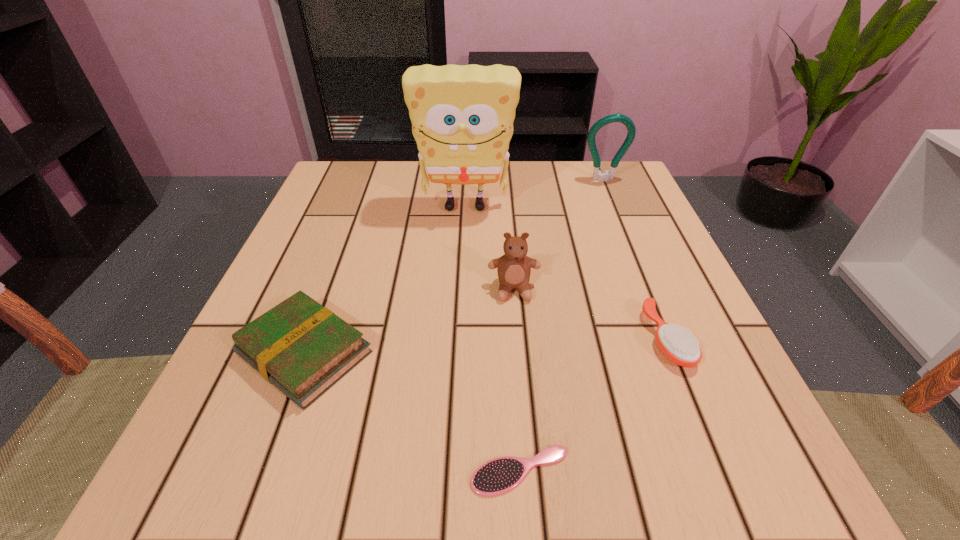
Identify the location of sponge. This screenshot has width=960, height=540. (462, 116).

Where is `the second farthest object`? This screenshot has width=960, height=540. the second farthest object is located at coordinates (462, 116).

Locate an element on the screen. This screenshot has height=540, width=960. bottle opener is located at coordinates (597, 174).

Where is `the second tallest object`? The height and width of the screenshot is (540, 960). the second tallest object is located at coordinates (597, 174).

The width and height of the screenshot is (960, 540). In order to click on teddy bear in this screenshot , I will do `click(514, 267)`.

Find the location of a particular element. the third tallest object is located at coordinates 514,267.

At what (x,y) coordinates should I click in order to perform the action: click on the leftmost object. Please return your answer as a coordinate pair (x, y). The image size is (960, 540). Looking at the image, I should click on (301, 347).

Where is `the fifth tallest object`? the fifth tallest object is located at coordinates (679, 346).

The width and height of the screenshot is (960, 540). What are the coordinates of `the right hairbrush` in the screenshot? It's located at (679, 346).

Where is `the shortest object`? the shortest object is located at coordinates pyautogui.click(x=500, y=475).